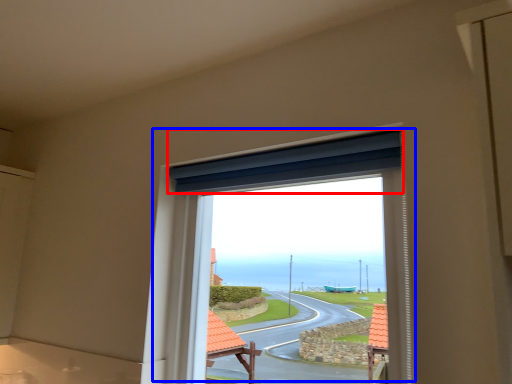
Question: Which object appears closest to the camera in this image, curtain (highlighted by a red box) or window (highlighted by a blue box)?

Choices:
 (A) curtain
 (B) window

Answer: (B)